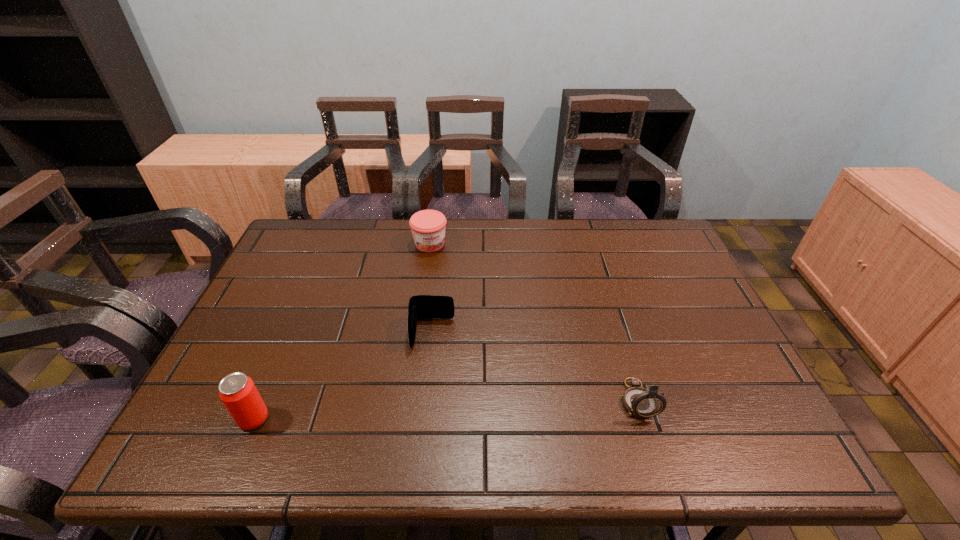
This screenshot has height=540, width=960. In order to click on free space at the far left corner of the desktop in this screenshot , I will do `click(319, 248)`.

In the image, there is a desktop. Where is `vacant area at the far right corner`? The width and height of the screenshot is (960, 540). vacant area at the far right corner is located at coordinates (629, 232).

Where is `free space between the beer can and the compass`? The height and width of the screenshot is (540, 960). free space between the beer can and the compass is located at coordinates (445, 409).

Locate an element on the screen. This screenshot has height=540, width=960. free point between the farthest object and the leftmost object is located at coordinates (342, 331).

This screenshot has height=540, width=960. In order to click on empty space that is in between the compass and the farthest object in this screenshot , I will do pos(534,321).

The height and width of the screenshot is (540, 960). In order to click on free space between the rightmost object and the wallet in this screenshot , I will do `click(535, 367)`.

Locate an element on the screen. This screenshot has width=960, height=540. free space between the rightmost object and the beer can is located at coordinates (445, 409).

Identify the location of vacant area between the beer can and the second farthest object. Image resolution: width=960 pixels, height=540 pixels. (343, 376).

I want to click on free point between the leftmost object and the jam, so click(342, 331).

You are a GUI agent. You are given a task and a screenshot of the screen. Output one action in this format:
    pyautogui.click(x=<x>, y=<y>)
    Task: Click on the empty space between the beer can and the jam
    Image resolution: width=960 pixels, height=540 pixels.
    Given the screenshot: What is the action you would take?
    pyautogui.click(x=342, y=331)